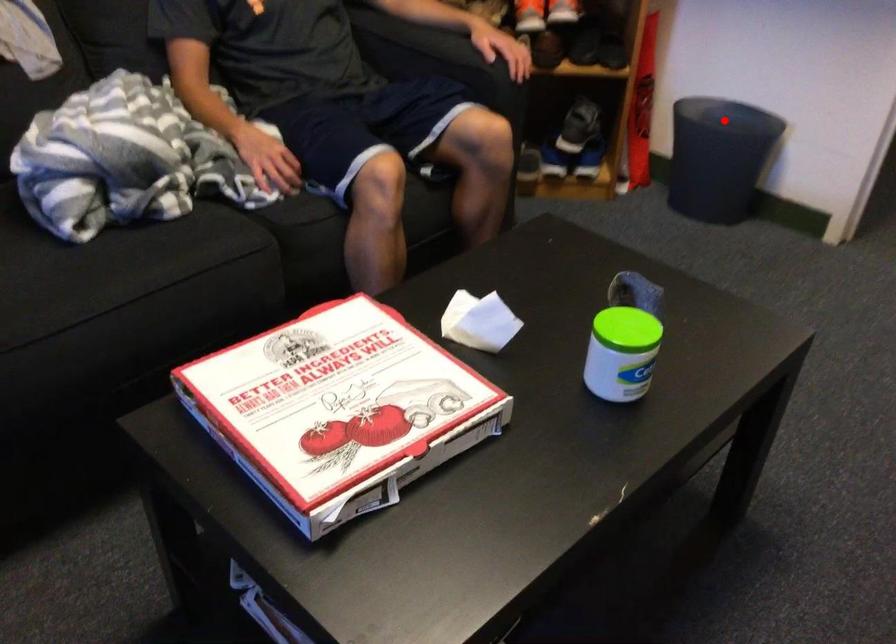
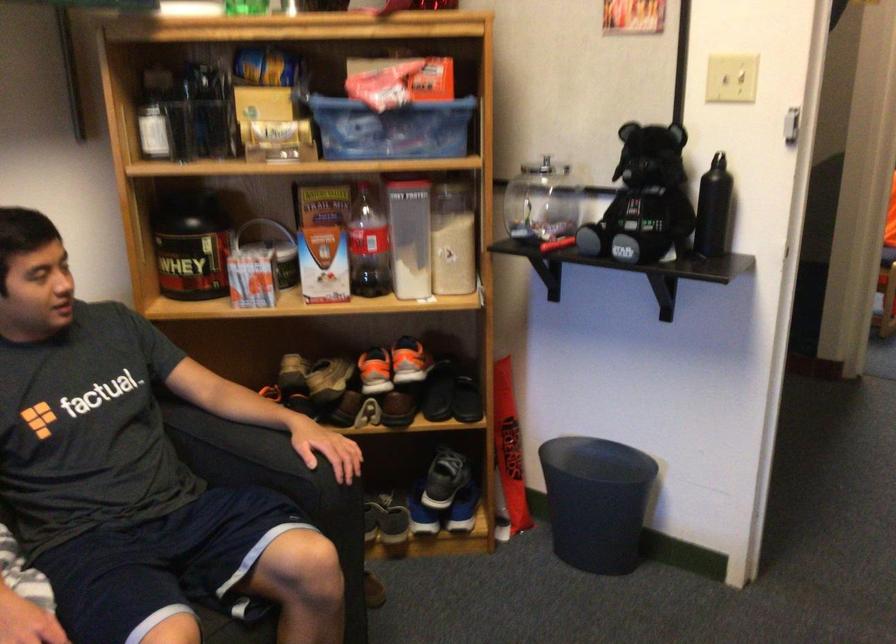
The point at the highlighted location is marked in the first image. Where is the corresponding point in the second image?

(597, 460)